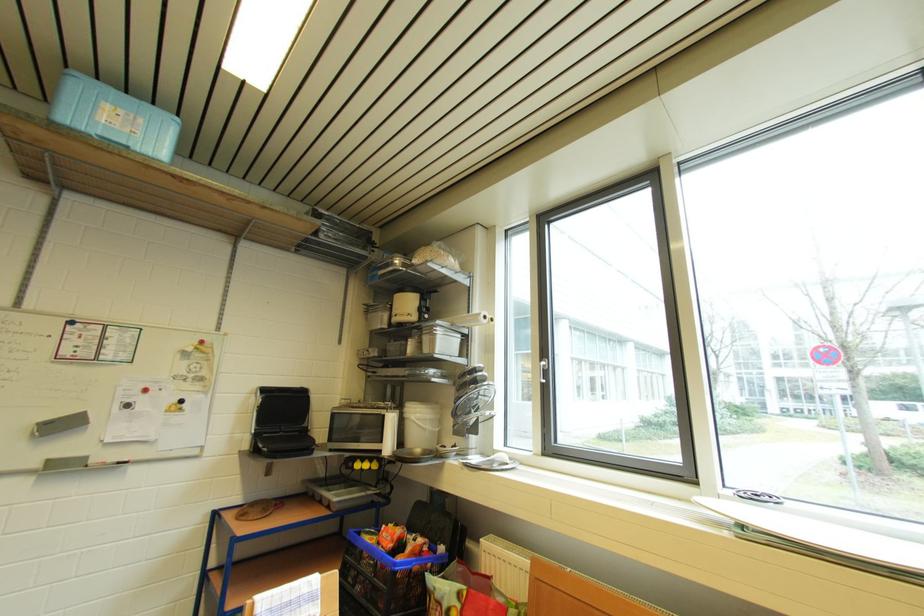
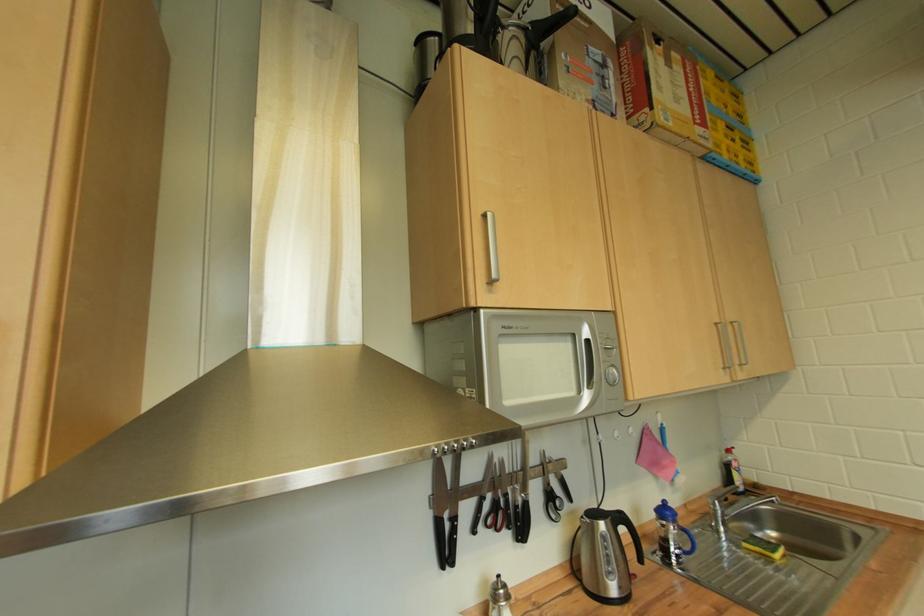
Question: The camera is either moving clockwise (left) or counter-clockwise (right) around the object. The first image is from the beginning of the video and the second image is from the end. Is the camera moving left or right when shooting the video?

Choices:
 (A) Left
 (B) Right

Answer: (B)